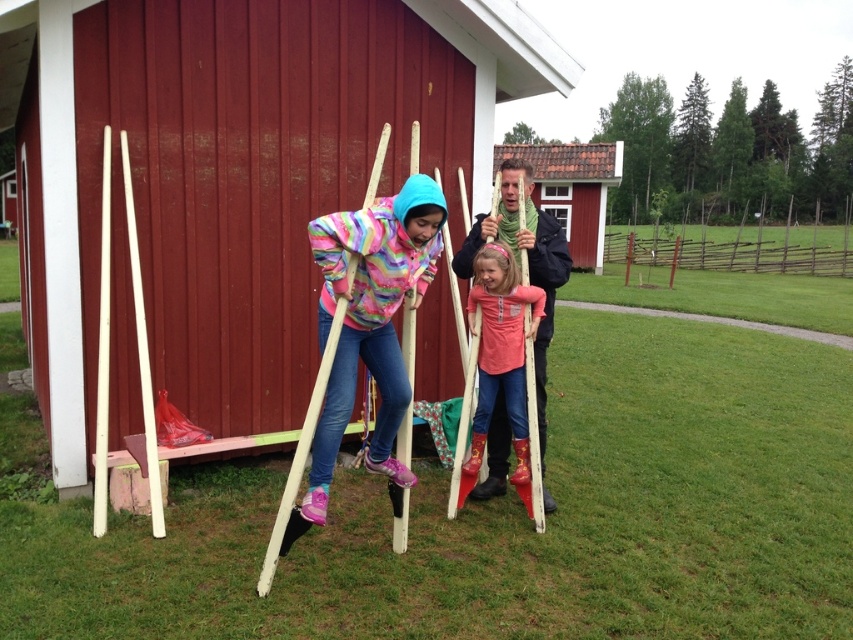
What do you see at coordinates (231, 172) in the screenshot?
I see `smooth wooden sticks at center` at bounding box center [231, 172].

Looking at this image, does smooth wooden sticks at center have a larger size compared to brown tiled roof at upper center?

Incorrect, smooth wooden sticks at center is not larger than brown tiled roof at upper center.

Is point (206, 364) positioned in front of point (572, 145)?

Yes, point (206, 364) is closer to viewer.

Where is `smooth wooden sticks at center`? This screenshot has width=853, height=640. smooth wooden sticks at center is located at coordinates (231, 172).

Between matte pink sweater at center and brown tiled roof at upper center, which one has less height?

Standing shorter between the two is matte pink sweater at center.

Can you confirm if matte pink sweater at center is thinner than brown tiled roof at upper center?

Yes, matte pink sweater at center is thinner than brown tiled roof at upper center.

Which is behind, point (500, 230) or point (569, 147)?

The point (569, 147) is behind.

At what (x,y) coordinates should I click in order to perform the action: click on matte pink sweater at center. Please return your answer as a coordinate pair (x, y). Looking at the image, I should click on (535, 268).

Which is behind, point (144, 56) or point (546, 285)?

Positioned behind is point (546, 285).

Where is `smooth wooden sticks at center`? The width and height of the screenshot is (853, 640). smooth wooden sticks at center is located at coordinates (231, 172).